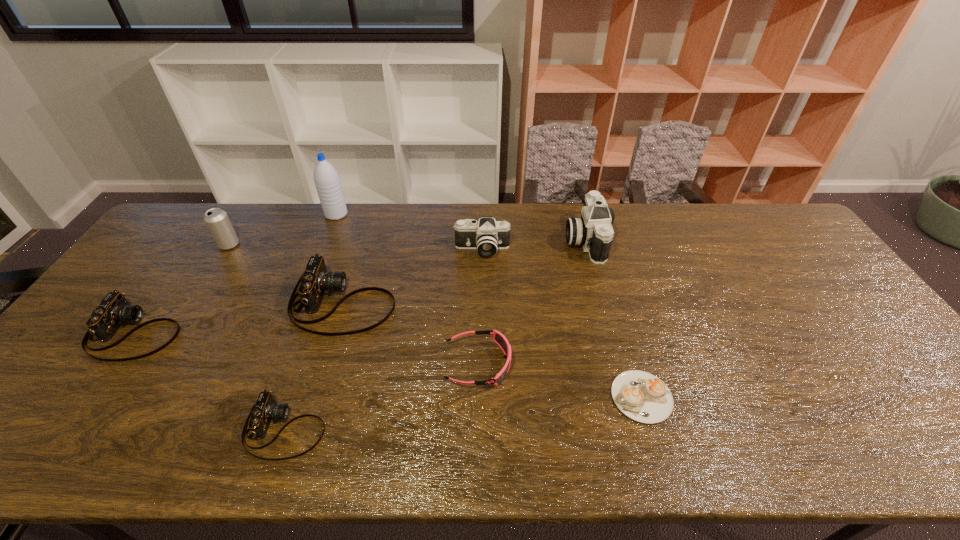
What are the coordinates of `the leftmost brown camera` in the screenshot? It's located at (114, 310).

This screenshot has width=960, height=540. Identify the location of pink goggles. (499, 338).

Identify the location of the smallest brown camera. The width and height of the screenshot is (960, 540). (265, 410).

Identify the location of the nearest brown camera. (265, 410).

Find the location of a particular element. white cappuccino is located at coordinates (643, 397).

The image size is (960, 540). What are the coordinates of `cappuccino` in the screenshot? It's located at click(x=643, y=397).

Locate an element on the screen. The image size is (960, 540). vacant space located 0.370m on the front of the tallest object is located at coordinates (303, 299).

Identify the location of vacant space located 0.390m on the front of the right black camera. The width and height of the screenshot is (960, 540). point(619,370).

The image size is (960, 540). I want to click on free space located 0.320m on the front of the beer can, so click(176, 328).

Where is `vacant space situated on the front of the left black camera`? Image resolution: width=960 pixels, height=540 pixels. vacant space situated on the front of the left black camera is located at coordinates (482, 343).